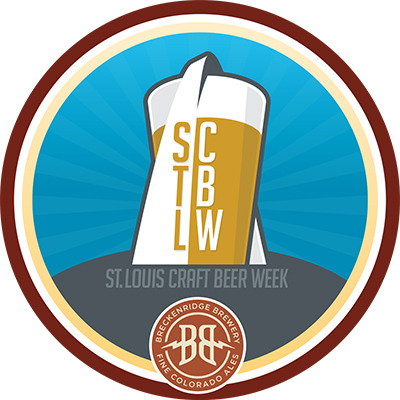
This screenshot has height=400, width=400. Find the location of `foam`. foam is located at coordinates (224, 97).